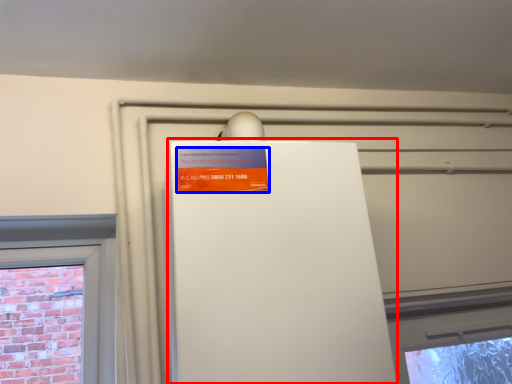
Question: Among these objects, which one is nearest to the camera, appliance (highlighted by a red box) or advertisement (highlighted by a blue box)?

Choices:
 (A) appliance
 (B) advertisement

Answer: (A)